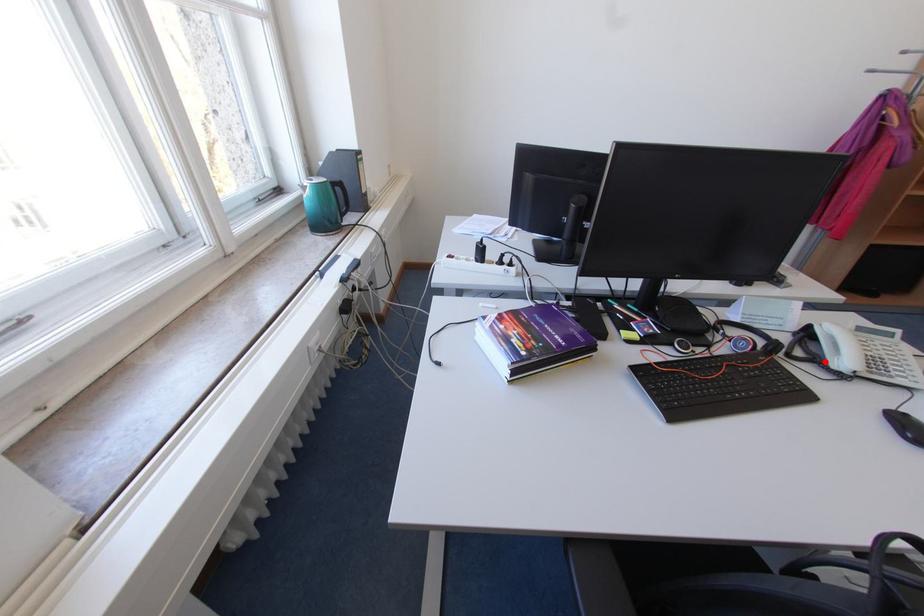
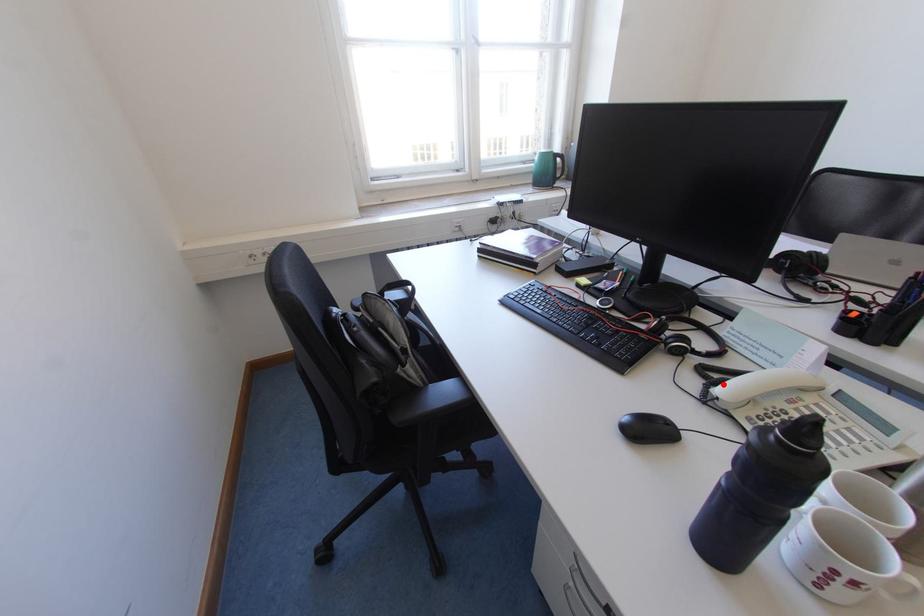
I am providing you with two images of the same scene from different viewpoints. A red point is marked on the first image and another point is marked on the second image. Is the red point in image1 aligned with the point shown in image2?

Yes